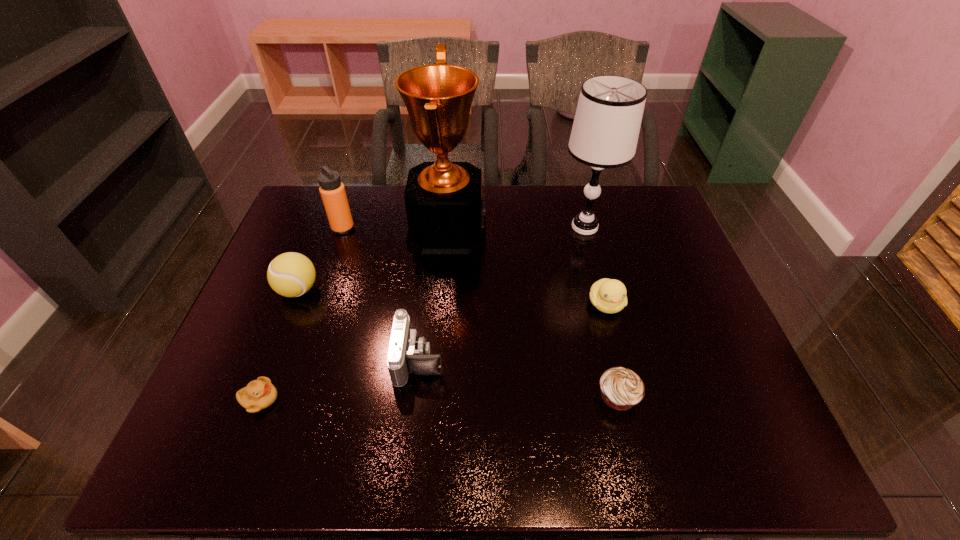
At what (x,y) coordinates should I click in order to perform the action: click on vacant space at the far right corner of the desktop. Please return your answer as a coordinate pair (x, y). Looking at the image, I should click on (629, 188).

Locate an element on the screen. The image size is (960, 540). free space at the near right corner of the desktop is located at coordinates coord(772,450).

The image size is (960, 540). What are the coordinates of `free space that is in between the muffin and the nearer duckling` in the screenshot? It's located at (439, 398).

The width and height of the screenshot is (960, 540). I want to click on free space between the muffin and the trophy cup, so click(533, 314).

What are the coordinates of `free space between the muffin and the thermos bottle` in the screenshot? It's located at (480, 312).

Where is `vacant space in between the tennis ball and the camera`? The width and height of the screenshot is (960, 540). vacant space in between the tennis ball and the camera is located at coordinates tap(359, 325).

Find the location of `free point between the right duckling and the table lamp`. free point between the right duckling and the table lamp is located at coordinates (595, 266).

The height and width of the screenshot is (540, 960). Find the location of `empty space that is in between the trophy cup and the tennis ball`. empty space that is in between the trophy cup and the tennis ball is located at coordinates (372, 260).

The height and width of the screenshot is (540, 960). I want to click on vacant space that is in between the third tallest object and the camera, so click(x=381, y=294).

Find the location of a particular element. The image size is (960, 540). free point between the muffin and the farther duckling is located at coordinates (612, 350).